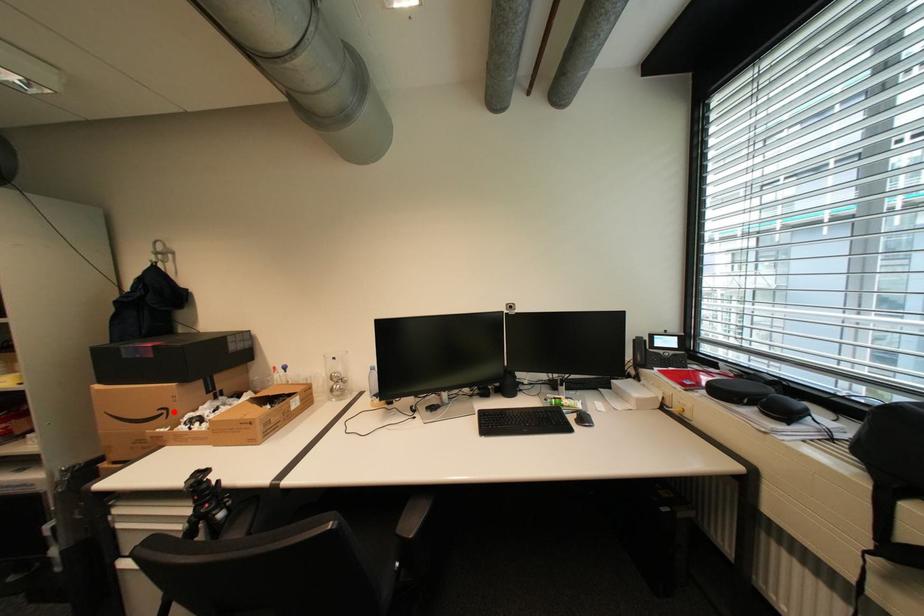
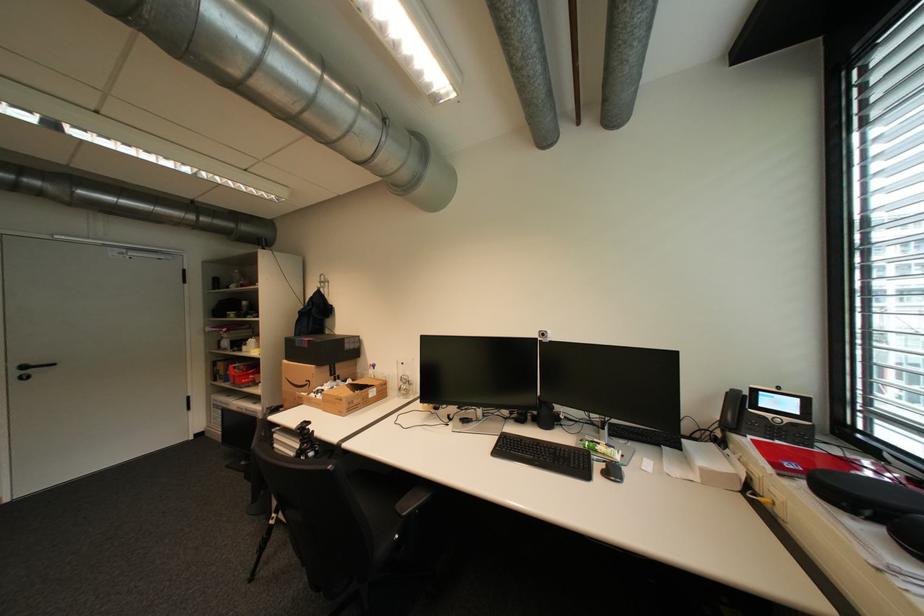
Question: I am providing you with two images of the same scene from different viewpoints. In image1, a red point is highlighted. Considering the same 3D point in image2, which of the following is correct?

Choices:
 (A) It is closer
 (B) It is farther

Answer: (B)